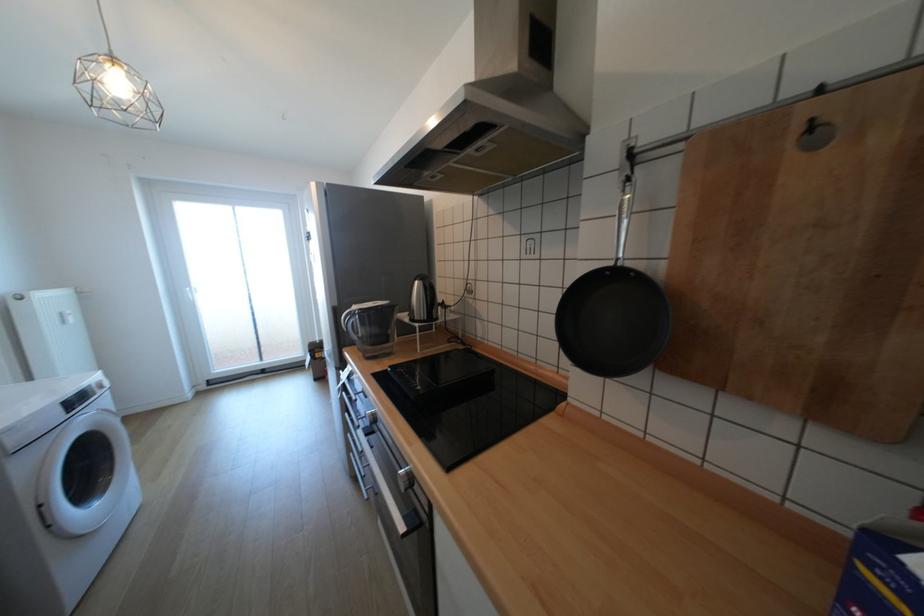
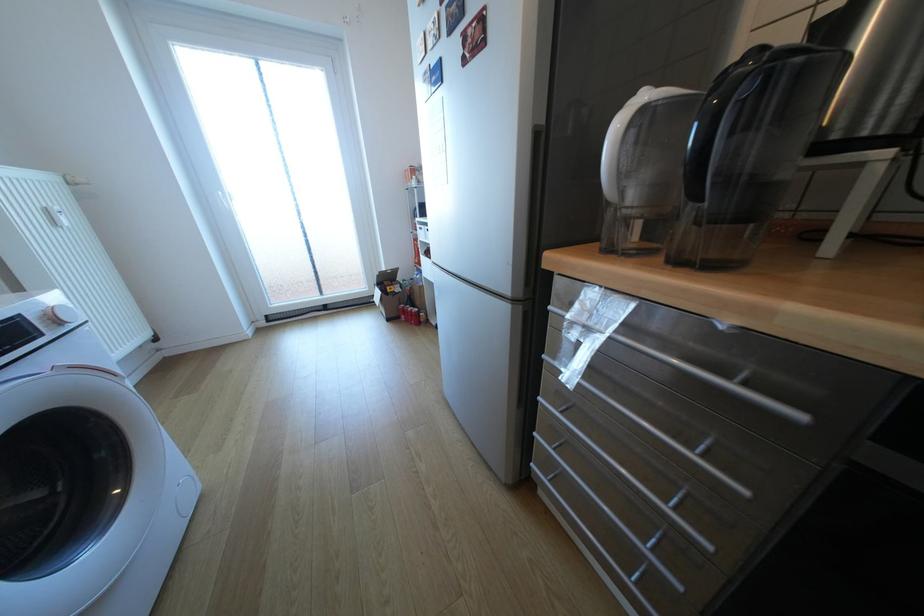
Where in the second image is the point corresponding to the point at 325,354 from the first image?

(397, 288)